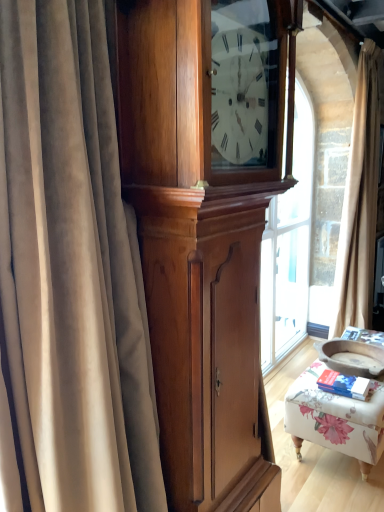
Question: From the image's perspective, does polished wood cabinet at center appear lower than velvet curtain at left, positioned as the 2th curtain in right-to-left order?

Choices:
 (A) yes
 (B) no

Answer: (A)

Question: Is polished wood cabinet at center wider than velvet curtain at left, arranged as the first curtain when viewed from the left?

Choices:
 (A) yes
 (B) no

Answer: (B)

Question: Is polished wood cabinet at center to the left of velvet curtain at left, positioned as the 2th curtain in right-to-left order, from the viewer's perspective?

Choices:
 (A) yes
 (B) no

Answer: (B)

Question: Is polished wood cabinet at center at the right side of velvet curtain at left, positioned as the 2th curtain in right-to-left order?

Choices:
 (A) no
 (B) yes

Answer: (B)

Question: Are polished wood cabinet at center and velvet curtain at left, positioned as the 2th curtain in right-to-left order, beside each other?

Choices:
 (A) no
 (B) yes

Answer: (A)

Question: Is polished wood cabinet at center to the left or to the right of floral fabric ottoman at lower right in the image?

Choices:
 (A) right
 (B) left

Answer: (B)

Question: Based on their sizes in the image, would you say polished wood cabinet at center is bigger or smaller than floral fabric ottoman at lower right?

Choices:
 (A) big
 (B) small

Answer: (A)

Question: Considering the positions of polished wood cabinet at center and floral fabric ottoman at lower right in the image, is polished wood cabinet at center wider or thinner than floral fabric ottoman at lower right?

Choices:
 (A) wide
 (B) thin

Answer: (B)

Question: From the image's perspective, relative to floral fabric ottoman at lower right, is polished wood cabinet at center above or below?

Choices:
 (A) below
 (B) above

Answer: (B)

Question: Is polished wood cabinet at center in front of or behind beige velvet curtain at right, the 2th curtain positioned from the front, in the image?

Choices:
 (A) behind
 (B) front

Answer: (B)

Question: In terms of size, does polished wood cabinet at center appear bigger or smaller than beige velvet curtain at right, marked as the 1th curtain in a back-to-front arrangement?

Choices:
 (A) small
 (B) big

Answer: (A)

Question: From the image's perspective, is polished wood cabinet at center above or below beige velvet curtain at right, which ranks as the 2th curtain in left-to-right order?

Choices:
 (A) above
 (B) below

Answer: (B)

Question: Does point (139, 6) appear closer or farther from the camera than point (362, 202)?

Choices:
 (A) farther
 (B) closer

Answer: (B)

Question: Looking at their shapes, would you say beige velvet curtain at right, marked as the 1th curtain in a right-to-left arrangement, is wider or thinner than polished wood cabinet at center?

Choices:
 (A) wide
 (B) thin

Answer: (B)

Question: Does point (349, 257) appear closer or farther from the camera than point (248, 103)?

Choices:
 (A) closer
 (B) farther

Answer: (B)